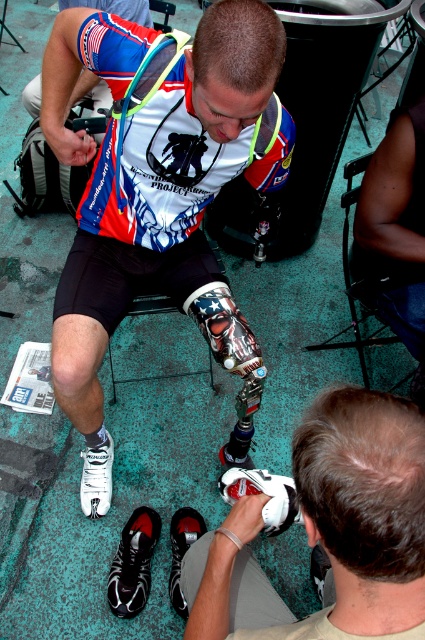
The width and height of the screenshot is (425, 640). What do you see at coordinates (331, 529) in the screenshot?
I see `white matte prosthetic leg at lower center` at bounding box center [331, 529].

Where is `white matte prosthetic leg at lower center`? Image resolution: width=425 pixels, height=640 pixels. white matte prosthetic leg at lower center is located at coordinates (331, 529).

Does black mesh shoe at lower left appear on the left side of white matte shoe at lower center?

Indeed, black mesh shoe at lower left is positioned on the left side of white matte shoe at lower center.

Is black mesh shoe at lower left taller than white matte shoe at lower center?

Yes, black mesh shoe at lower left is taller than white matte shoe at lower center.

Between point (115, 561) and point (283, 518), which one is positioned behind?

Point (115, 561)

This screenshot has height=640, width=425. What are the coordinates of `black mesh shoe at lower left` in the screenshot? It's located at (133, 563).

Which of these two, metallic prosthetic leg at center or white matte prosthetic leg at lower center, stands shorter?

white matte prosthetic leg at lower center

Does metallic prosthetic leg at center have a smaller size compared to white matte prosthetic leg at lower center?

Actually, metallic prosthetic leg at center might be larger than white matte prosthetic leg at lower center.

Locate an element on the screen. metallic prosthetic leg at center is located at coordinates (158, 177).